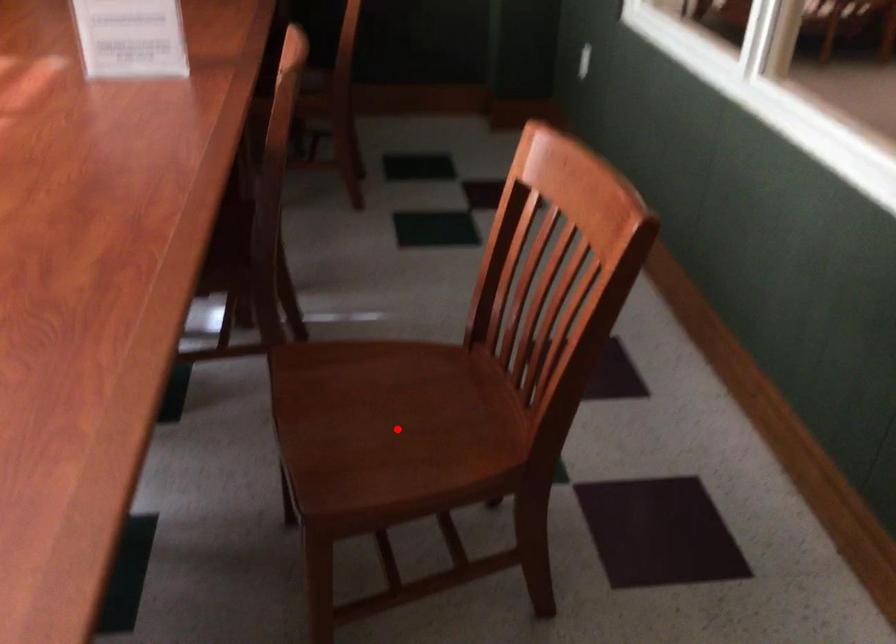
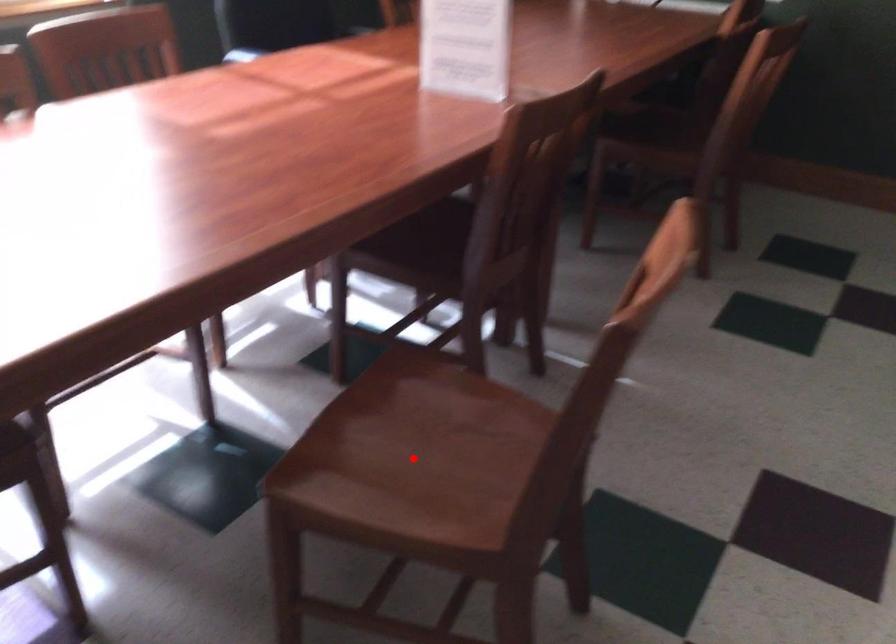
I am providing you with two images of the same scene from different viewpoints. A red point is marked on the first image and another point is marked on the second image. Is the red point in image1 aligned with the point shown in image2?

Yes